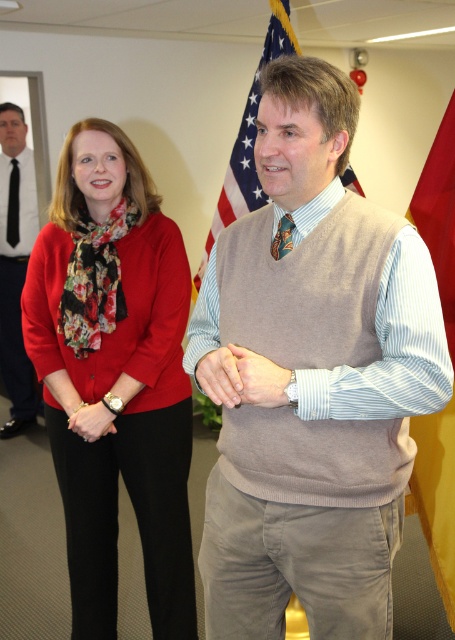
You are standing in an office and see two points marked in the image. Which point is nearer to you, point (115, 554) or point (10, 161)?

Point (115, 554) is closer to the viewer than point (10, 161).

You are a photographer setting up for a group photo in an office. You notice the american flag at center and the black silk tie at center. Which object is positioned higher in the image?

The american flag at center is positioned higher in the image since it is much taller than the black silk tie at center.